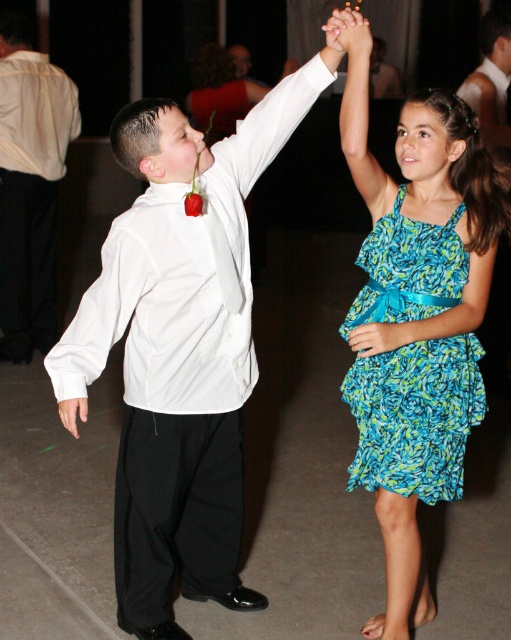
Question: Is white satin shirt at upper left below white satin shirt at left?

Choices:
 (A) yes
 (B) no

Answer: (A)

Question: Is white satin shirt at upper left positioned at the back of blue floral chiffon dress at center?

Choices:
 (A) yes
 (B) no

Answer: (B)

Question: Among these points, which one is nearest to the camera?

Choices:
 (A) (359, 16)
 (B) (440, 269)

Answer: (A)

Question: Which point is closer to the camera?

Choices:
 (A) blue floral chiffon dress at center
 (B) white satin shirt at upper center
 (C) matte white hand at upper center

Answer: (C)

Question: Among these objects, which one is farthest from the camera?

Choices:
 (A) blue floral chiffon dress at center
 (B) blue printed dress at upper right

Answer: (A)

Question: Does white satin shirt at left appear on the right side of white satin shirt at upper center?

Choices:
 (A) no
 (B) yes

Answer: (A)